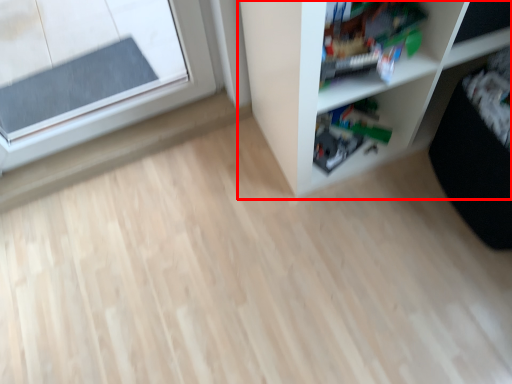
Question: Considering the relative positions of shelf (annotated by the red box) and toy in the image provided, where is shelf (annotated by the red box) located with respect to the staircase?

Choices:
 (A) right
 (B) left

Answer: (A)